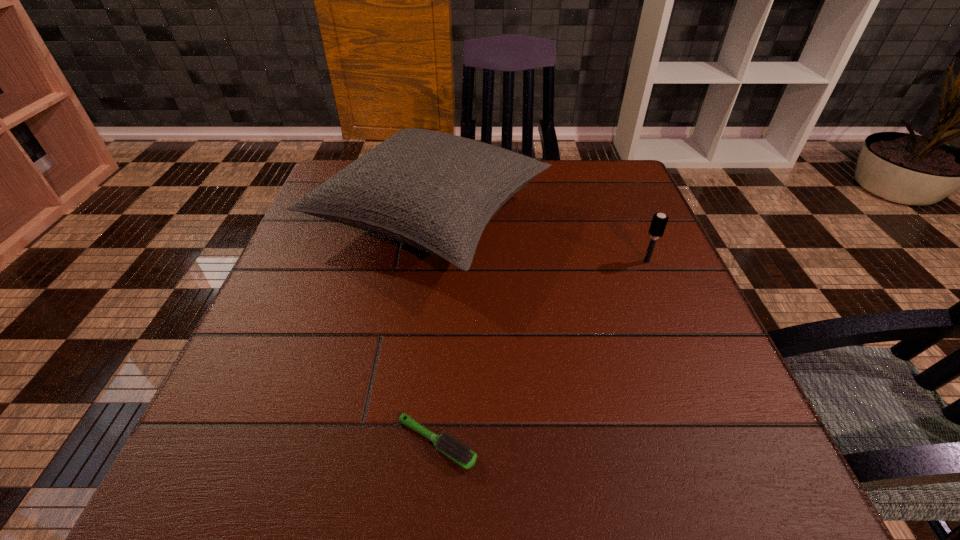
The height and width of the screenshot is (540, 960). What are the coordinates of `object located at the left edge` in the screenshot? It's located at (434, 191).

You are a GUI agent. You are given a task and a screenshot of the screen. Output one action in this format:
    pyautogui.click(x=<x>, y=<y>)
    Task: Click on the object that is at the right edge
    The width and height of the screenshot is (960, 540).
    Given the screenshot: What is the action you would take?
    [x=659, y=221]

Identify the location of object present at the far left corner. The image size is (960, 540). (x=434, y=191).

Locate an element on the screen. The height and width of the screenshot is (540, 960). free space at the far edge is located at coordinates (551, 206).

The width and height of the screenshot is (960, 540). Identify the location of vacant area at the near edge of the desktop. (459, 474).

Locate an element on the screen. This screenshot has height=540, width=960. free spot at the left edge of the desktop is located at coordinates (289, 311).

Where is `vacant area at the right edge`? The height and width of the screenshot is (540, 960). vacant area at the right edge is located at coordinates (596, 230).

At what (x,y) coordinates should I click in order to perform the action: click on free region at the far right corner of the desktop. Please return your answer as a coordinate pair (x, y). Image resolution: width=960 pixels, height=540 pixels. Looking at the image, I should click on pyautogui.click(x=630, y=190).

Where is `free space between the shortest object and the cushion`? Image resolution: width=960 pixels, height=540 pixels. free space between the shortest object and the cushion is located at coordinates tap(434, 330).

Where is `vacant space that's between the tallest object and the nearest object`? This screenshot has height=540, width=960. vacant space that's between the tallest object and the nearest object is located at coordinates (434, 330).